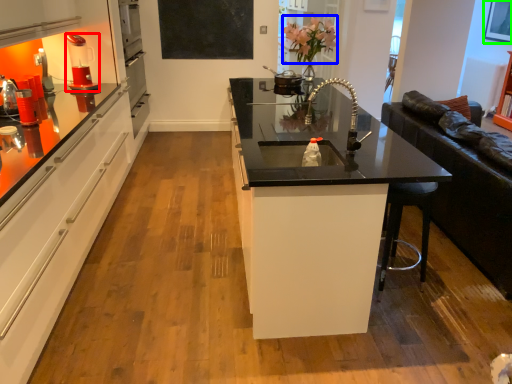
Question: Which object is positioned closest to coffee machine (highlighted by a red box)? Select from flower (highlighted by a blue box) and picture frame (highlighted by a green box).

Choices:
 (A) flower
 (B) picture frame

Answer: (A)